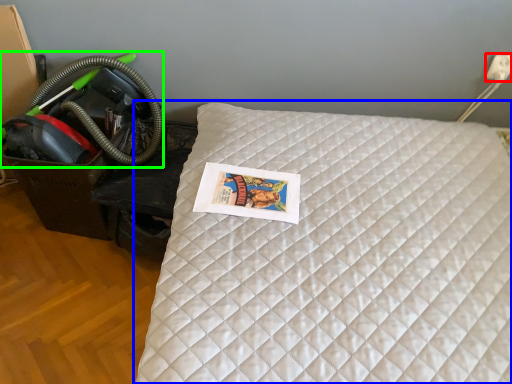
Question: Which object is the farthest from electric outlet (highlighted by a red box)? Choose among these: bed (highlighted by a blue box) or garden hose (highlighted by a green box).

Choices:
 (A) bed
 (B) garden hose

Answer: (B)